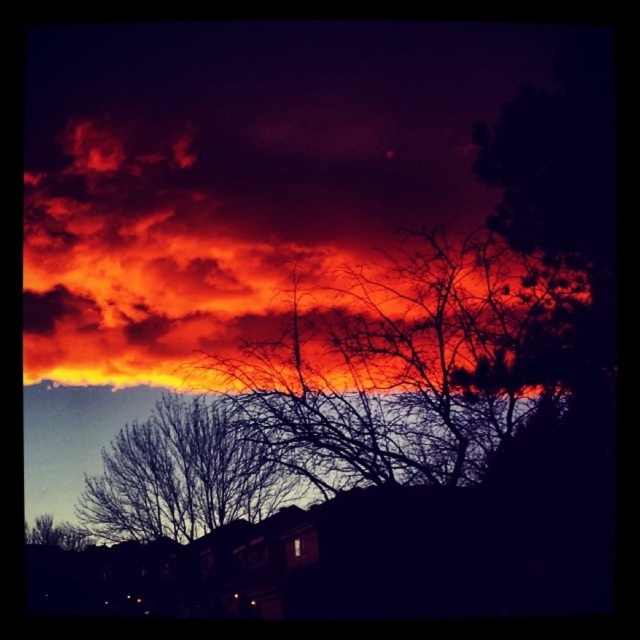
Image resolution: width=640 pixels, height=640 pixels. What do you see at coordinates (208, 244) in the screenshot?
I see `fiery orange cloud at upper center` at bounding box center [208, 244].

Is the position of fiery orange cloud at upper center more distant than that of silhouette bare tree at lower left?

Yes, fiery orange cloud at upper center is behind silhouette bare tree at lower left.

Between point (340, 259) and point (33, 532), which one is positioned in front?

Point (33, 532) is more forward.

Image resolution: width=640 pixels, height=640 pixels. Find the location of `fiery orange cloud at upper center`. fiery orange cloud at upper center is located at coordinates (208, 244).

Does silhouette bare branches at center have a larger size compared to bare branches at center?

Yes, silhouette bare branches at center is bigger than bare branches at center.

Is silhouette bare branches at center below bare branches at center?

Actually, silhouette bare branches at center is above bare branches at center.

Where is `silhouette bare branches at center`? silhouette bare branches at center is located at coordinates tap(397, 364).

Which is behind, point (99, 486) or point (33, 544)?

Point (99, 486)

Is point (257, 467) positioned behind point (35, 538)?

Yes, it is.

Where is `bare branches at center`? bare branches at center is located at coordinates [180, 476].